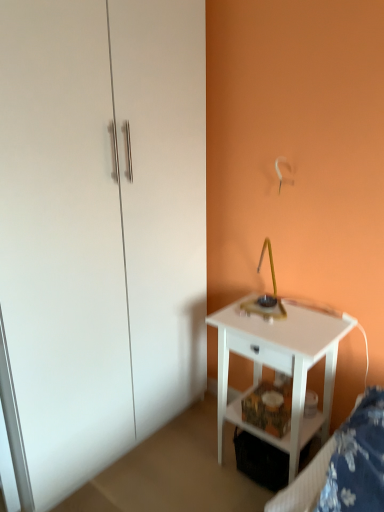
Question: Is white fabric bed frame at lower right to the right of white glossy nightstand at lower right from the viewer's perspective?

Choices:
 (A) yes
 (B) no

Answer: (A)

Question: Does white fabric bed frame at lower right have a greater width compared to white glossy nightstand at lower right?

Choices:
 (A) no
 (B) yes

Answer: (A)

Question: Is white fabric bed frame at lower right outside of white glossy nightstand at lower right?

Choices:
 (A) yes
 (B) no

Answer: (A)

Question: Is white fabric bed frame at lower right positioned in front of white glossy nightstand at lower right?

Choices:
 (A) no
 (B) yes

Answer: (B)

Question: Can you confirm if white fabric bed frame at lower right is shorter than white glossy nightstand at lower right?

Choices:
 (A) no
 (B) yes

Answer: (B)

Question: Choose the correct answer: Is white fabric bed frame at lower right inside white glossy dresser at left or outside it?

Choices:
 (A) inside
 (B) outside

Answer: (B)

Question: In the image, is white fabric bed frame at lower right positioned in front of or behind white glossy dresser at left?

Choices:
 (A) behind
 (B) front

Answer: (B)

Question: Looking at the image, does white fabric bed frame at lower right seem bigger or smaller compared to white glossy dresser at left?

Choices:
 (A) big
 (B) small

Answer: (B)

Question: Visually, is white fabric bed frame at lower right positioned to the left or to the right of white glossy dresser at left?

Choices:
 (A) right
 (B) left

Answer: (A)

Question: Based on their positions, is white glossy dresser at left located to the left or right of white glossy nightstand at lower right?

Choices:
 (A) right
 (B) left

Answer: (B)

Question: From the image's perspective, is white glossy dresser at left above or below white glossy nightstand at lower right?

Choices:
 (A) above
 (B) below

Answer: (A)

Question: Is white glossy dresser at left taller or shorter than white glossy nightstand at lower right?

Choices:
 (A) tall
 (B) short

Answer: (A)

Question: Is white glossy dresser at left wider or thinner than white glossy nightstand at lower right?

Choices:
 (A) wide
 (B) thin

Answer: (A)

Question: In terms of width, does white fabric bed frame at lower right look wider or thinner when compared to white glossy nightstand at lower right?

Choices:
 (A) wide
 (B) thin

Answer: (B)

Question: In terms of size, does white fabric bed frame at lower right appear bigger or smaller than white glossy nightstand at lower right?

Choices:
 (A) small
 (B) big

Answer: (A)